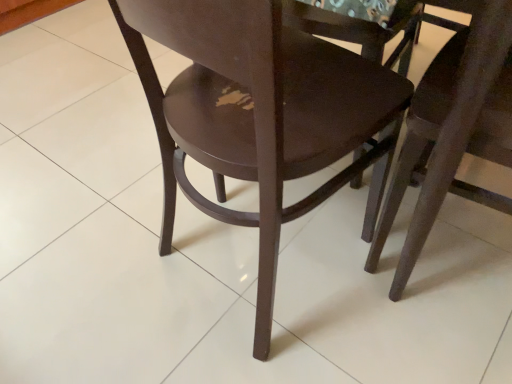
Question: Is there a large distance between glossy wood chair at center, marked as the 2th chair in a right-to-left arrangement, and dark wood chair at center, positioned as the 1th chair in right-to-left order?

Choices:
 (A) yes
 (B) no

Answer: (B)

Question: From the image's perspective, is glossy wood chair at center, marked as the 2th chair in a right-to-left arrangement, above dark wood chair at center, positioned as the 1th chair in right-to-left order?

Choices:
 (A) yes
 (B) no

Answer: (A)

Question: Does glossy wood chair at center, placed as the 1th chair when sorted from left to right, lie behind dark wood chair at center, positioned as the second chair in left-to-right order?

Choices:
 (A) yes
 (B) no

Answer: (B)

Question: Does glossy wood chair at center, marked as the 2th chair in a right-to-left arrangement, appear on the right side of dark wood chair at center, positioned as the second chair in left-to-right order?

Choices:
 (A) yes
 (B) no

Answer: (B)

Question: Does glossy wood chair at center, marked as the 2th chair in a right-to-left arrangement, turn towards dark wood chair at center, positioned as the 1th chair in right-to-left order?

Choices:
 (A) no
 (B) yes

Answer: (A)

Question: Is the position of glossy wood chair at center, placed as the 1th chair when sorted from left to right, less distant than that of dark wood chair at center, positioned as the second chair in left-to-right order?

Choices:
 (A) yes
 (B) no

Answer: (A)

Question: Is dark wood chair at center, positioned as the 1th chair in right-to-left order, bigger than glossy wood chair at center, marked as the 2th chair in a right-to-left arrangement?

Choices:
 (A) yes
 (B) no

Answer: (B)

Question: From the image's perspective, is dark wood chair at center, positioned as the 1th chair in right-to-left order, on top of glossy wood chair at center, marked as the 2th chair in a right-to-left arrangement?

Choices:
 (A) no
 (B) yes

Answer: (A)

Question: Considering the relative positions of dark wood chair at center, positioned as the 1th chair in right-to-left order, and glossy wood chair at center, marked as the 2th chair in a right-to-left arrangement, in the image provided, is dark wood chair at center, positioned as the 1th chair in right-to-left order, behind glossy wood chair at center, marked as the 2th chair in a right-to-left arrangement,?

Choices:
 (A) no
 (B) yes

Answer: (B)

Question: Does dark wood chair at center, positioned as the second chair in left-to-right order, have a smaller size compared to glossy wood chair at center, placed as the 1th chair when sorted from left to right?

Choices:
 (A) yes
 (B) no

Answer: (A)

Question: Is dark wood chair at center, positioned as the second chair in left-to-right order, shorter than glossy wood chair at center, placed as the 1th chair when sorted from left to right?

Choices:
 (A) no
 (B) yes

Answer: (B)

Question: Is dark wood chair at center, positioned as the 1th chair in right-to-left order, thinner than glossy wood chair at center, placed as the 1th chair when sorted from left to right?

Choices:
 (A) no
 (B) yes

Answer: (B)

Question: From a real-world perspective, is glossy wood chair at center, marked as the 2th chair in a right-to-left arrangement, positioned above or below dark wood chair at center, positioned as the second chair in left-to-right order?

Choices:
 (A) above
 (B) below

Answer: (A)